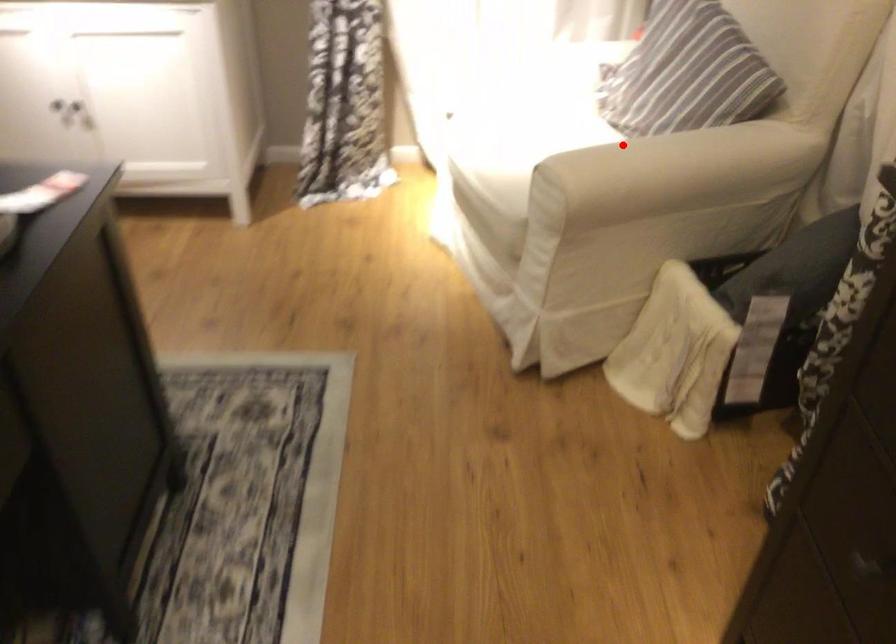
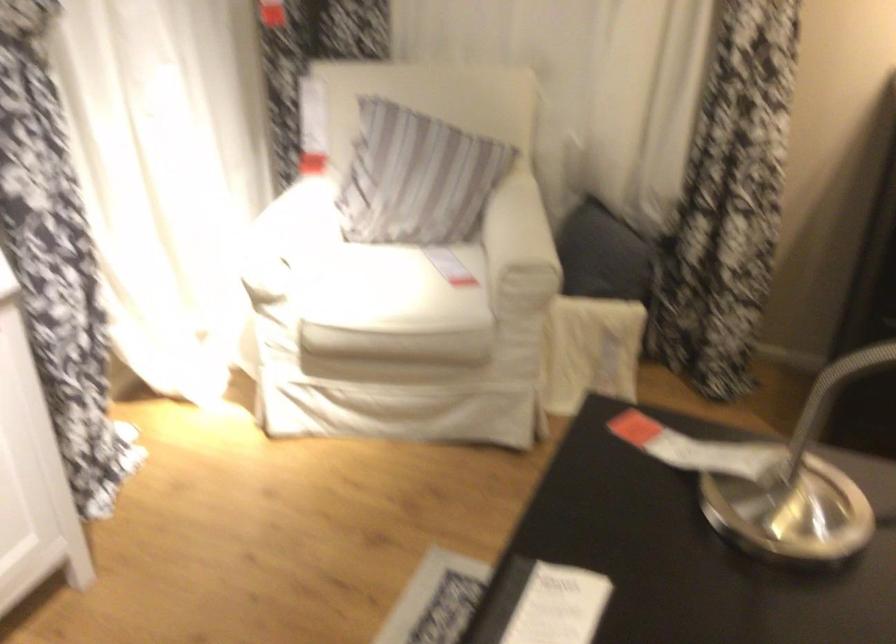
Question: A red point is marked in image1. In image2, is the corresponding 3D point closer to the camera or farther? Reply with the corresponding letter.

Choices:
 (A) The corresponding 3D point is closer.
 (B) The corresponding 3D point is farther.

Answer: (B)